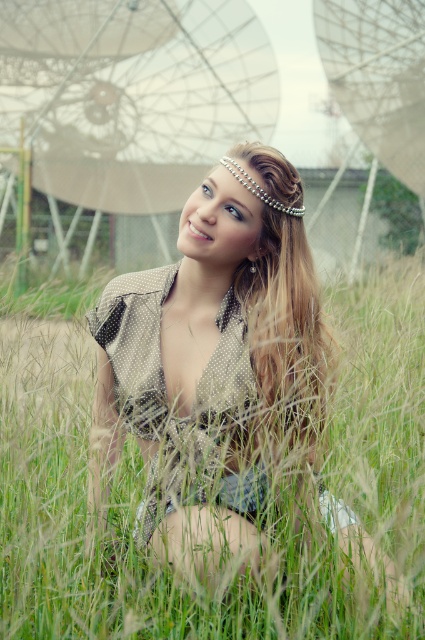
Question: Which point is closer to the camera?

Choices:
 (A) (249, 182)
 (B) (158, 490)

Answer: (B)

Question: Estimate the real-world distances between objects in this image. Which object is farther from the matte beige dress at center?

Choices:
 (A) blonde textured hair at center
 (B) pearl/textured hair accessory at upper center

Answer: (B)

Question: Can you confirm if matte beige dress at center is bigger than pearl/textured hair accessory at upper center?

Choices:
 (A) no
 (B) yes

Answer: (B)

Question: Is matte beige dress at center smaller than blonde textured hair at center?

Choices:
 (A) yes
 (B) no

Answer: (B)

Question: Does matte beige dress at center appear over pearl/textured hair accessory at upper center?

Choices:
 (A) no
 (B) yes

Answer: (A)

Question: Considering the real-world distances, which object is closest to the matte beige dress at center?

Choices:
 (A) blonde textured hair at center
 (B) pearl/textured hair accessory at upper center

Answer: (A)